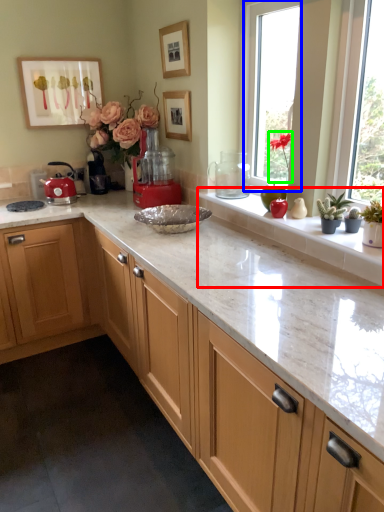
Question: Estimate the real-world distances between objects in this image. Which object is farther from window sill (highlighted by a red box), window (highlighted by a blue box) or plant (highlighted by a green box)?

Choices:
 (A) window
 (B) plant

Answer: (A)